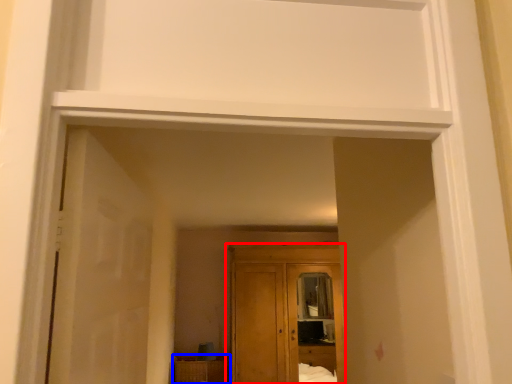
Question: Which object appears farthest to the camera in this image, cupboard (highlighted by a red box) or cabinetry (highlighted by a blue box)?

Choices:
 (A) cupboard
 (B) cabinetry

Answer: (B)